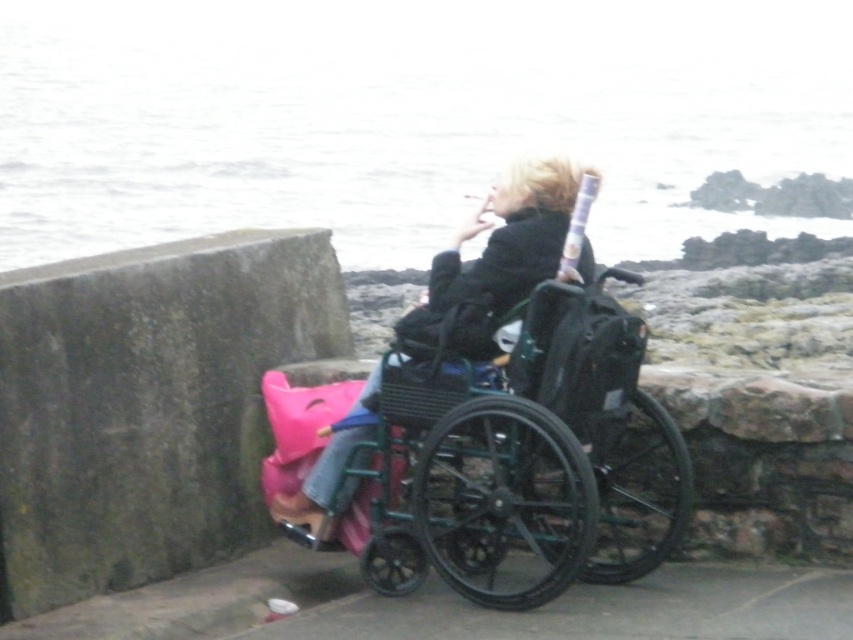
You are a caregiver assessing the space needed for two wheelchairs. The metallic green wheelchair at center and the matte black wheelchair at center are both in the scene. Which one requires more space due to its size?

The metallic green wheelchair at center requires more space because its width is larger than the matte black wheelchair at center.

You are a photographer standing at the shoreline. You want to take a photo of the matte black wheelchair at center and the white water at upper center. Which object should you focus on first to ensure both are in sharp focus?

You should focus on the matte black wheelchair at center first because it is closer to you than the white water at upper center, which is further away. By focusing on the closer object, the depth of field may also keep the white water at upper center in focus.